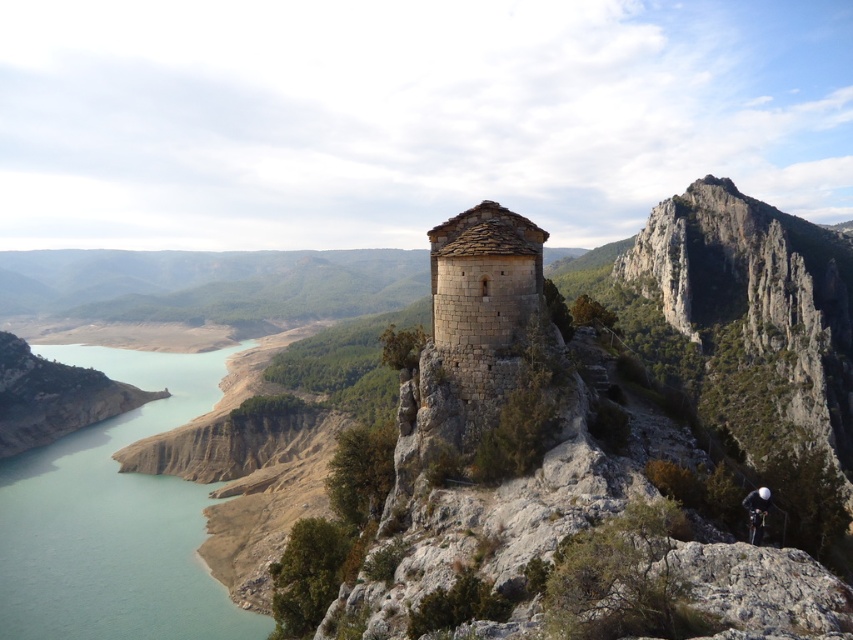
Question: Which object is farther from the camera taking this photo?

Choices:
 (A) stone tower at center
 (B) black fabric helmet at center

Answer: (A)

Question: Which point appears farthest from the camera in this image?

Choices:
 (A) (514, 236)
 (B) (181, 612)

Answer: (B)

Question: Among these objects, which one is farthest from the camera?

Choices:
 (A) black fabric helmet at center
 (B) stone tower at center
 (C) turquoise water at lower left

Answer: (C)

Question: Does stone tower at center appear over black fabric helmet at center?

Choices:
 (A) no
 (B) yes

Answer: (B)

Question: Does stone tower at center have a smaller size compared to black fabric helmet at center?

Choices:
 (A) no
 (B) yes

Answer: (A)

Question: Can you confirm if turquoise water at lower left is positioned to the right of stone tower at center?

Choices:
 (A) no
 (B) yes

Answer: (A)